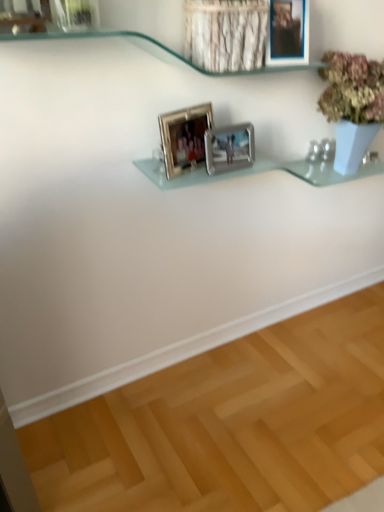
Question: Looking at their shapes, would you say silver metallic photo frame at center, which appears as the third picture frame when viewed from the right, is wider or thinner than silver metallic photo frame at center, marked as the second picture frame in a right-to-left arrangement?

Choices:
 (A) wide
 (B) thin

Answer: (A)

Question: Relative to silver metallic photo frame at center, marked as the second picture frame in a right-to-left arrangement, is silver metallic photo frame at center, which appears as the third picture frame when viewed from the right, in front or behind?

Choices:
 (A) behind
 (B) front

Answer: (B)

Question: Considering the real-world distances, which object is farthest from the clear glass shelf at upper center?

Choices:
 (A) silver metallic photo frame at center, marked as the second picture frame in a right-to-left arrangement
 (B) silver metallic photo frame at center, positioned as the 1th picture frame in left-to-right order
 (C) metallic silver picture frame at upper center, which is counted as the third picture frame, starting from the left

Answer: (A)

Question: Estimate the real-world distances between objects in this image. Which object is farther from the silver metallic photo frame at center, which appears as the 2th picture frame when viewed from the left?

Choices:
 (A) clear glass shelf at upper center
 (B) silver metallic photo frame at center, positioned as the 1th picture frame in left-to-right order
 (C) metallic silver picture frame at upper center, which ranks as the first picture frame in right-to-left order

Answer: (A)